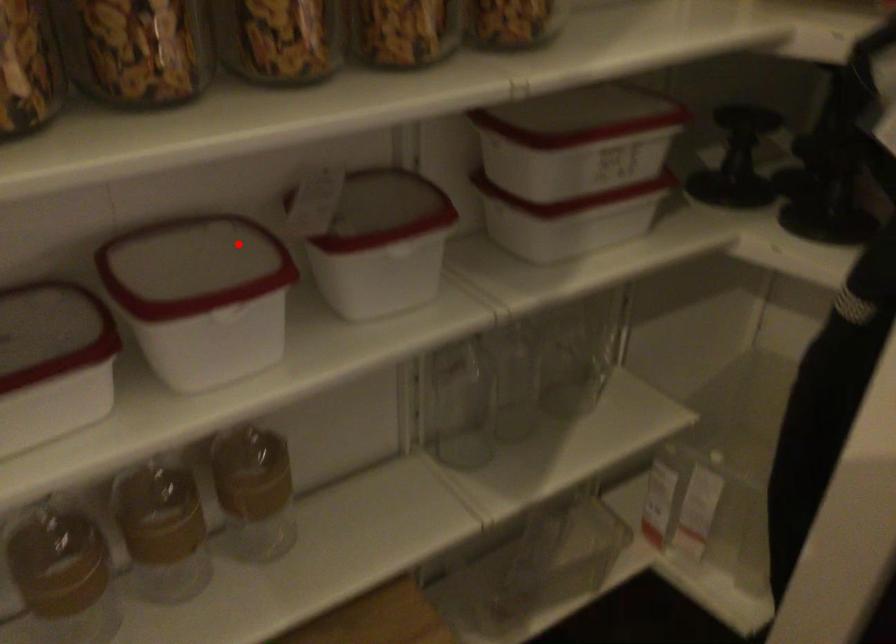
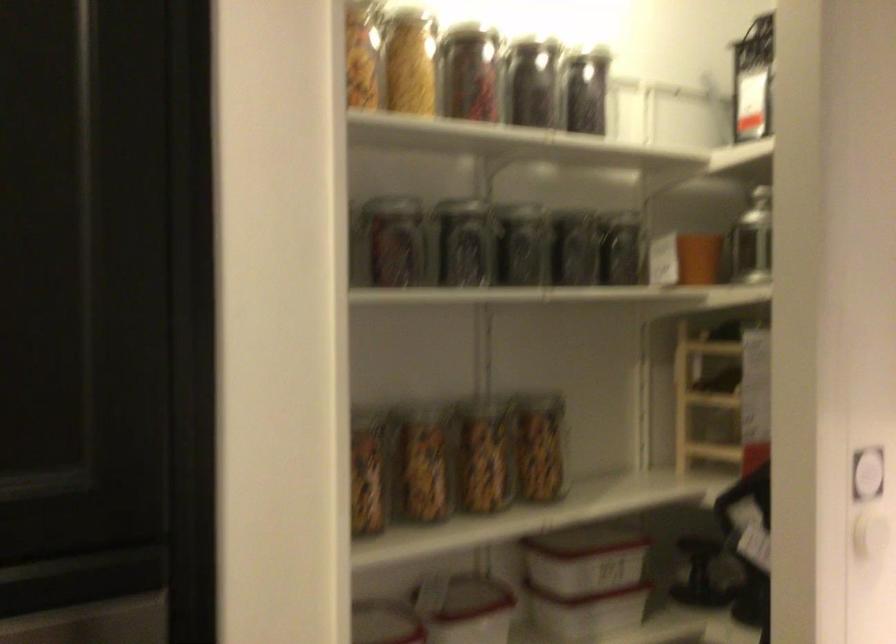
Question: I am providing you with two images of the same scene from different viewpoints. A red point is shown in image1. For the corresponding object point in image2, is it positioned nearer or farther from the camera?

Choices:
 (A) Nearer
 (B) Farther

Answer: (B)